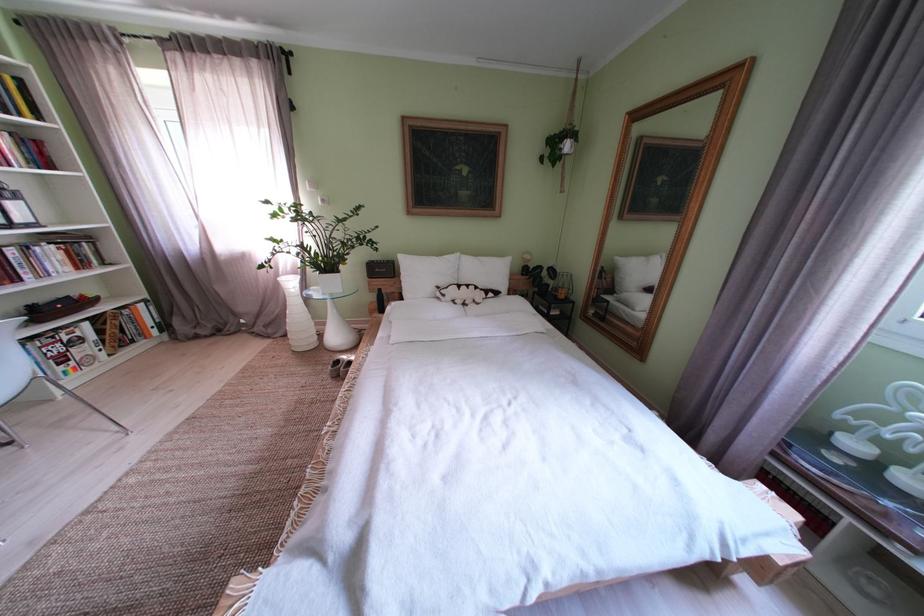
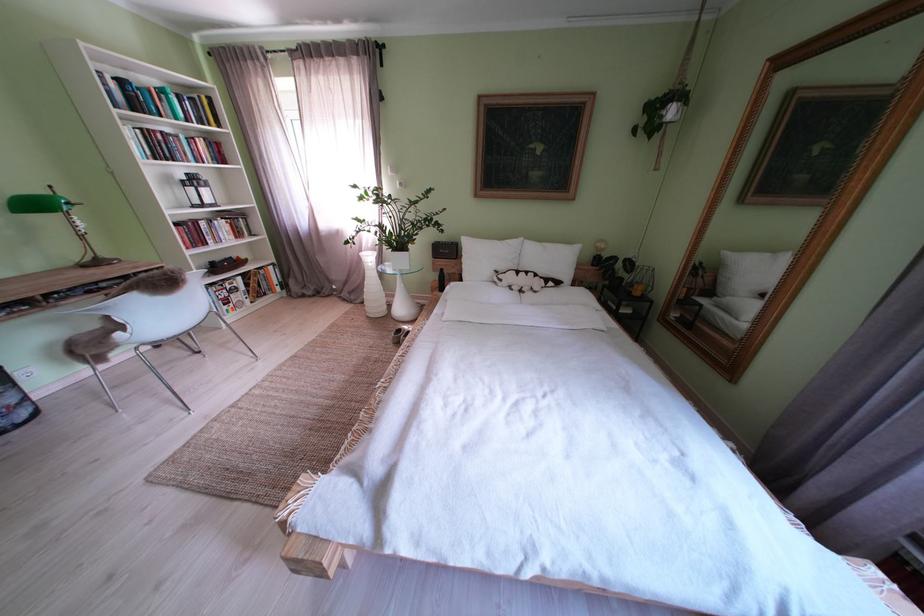
Where in the second image is the point corresponding to (282,336) from the first image?

(363, 302)